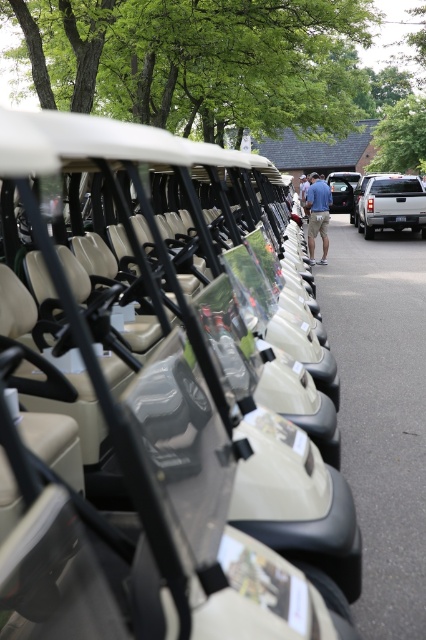
Can you confirm if beige matte golf cart at center is shorter than silver metallic truck at right?

No.

Does beige matte golf cart at center have a greater width compared to silver metallic truck at right?

Yes, beige matte golf cart at center is wider than silver metallic truck at right.

Which is behind, point (143, 452) or point (365, 177)?

Positioned behind is point (365, 177).

Where is `beige matte golf cart at center`? beige matte golf cart at center is located at coordinates (163, 410).

Image resolution: width=426 pixels, height=640 pixels. What do you see at coordinates (391, 204) in the screenshot?
I see `silver metallic truck at right` at bounding box center [391, 204].

Who is shorter, silver metallic truck at right or metallic silver suv at center?

silver metallic truck at right is shorter.

Who is more distant from viewer, [420,196] or [331,173]?

Positioned behind is point [331,173].

Find the location of a particular element. The image size is (426, 640). silver metallic truck at right is located at coordinates (391, 204).

Does blue denim shorts at center appear under metallic silver suv at center?

Yes, blue denim shorts at center is below metallic silver suv at center.

Find the location of a particular element. blue denim shorts at center is located at coordinates (317, 214).

Identify the location of blue denim shorts at center. The image size is (426, 640). (317, 214).